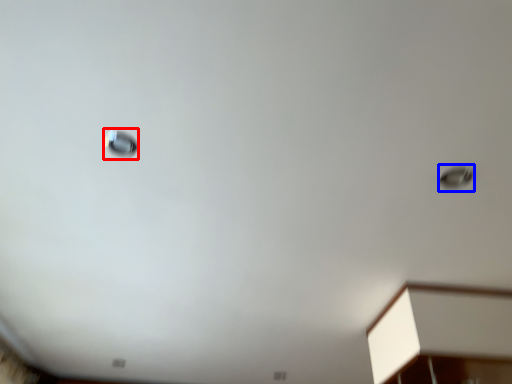
Question: Which point is further to the camera, droplight (highlighted by a red box) or droplight (highlighted by a blue box)?

Choices:
 (A) droplight
 (B) droplight

Answer: (B)